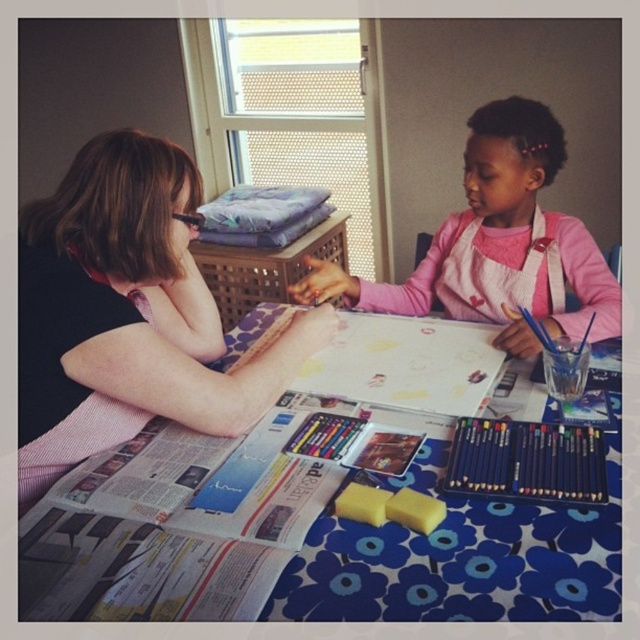
You are an artist who needs to store your supplies. You have a small box that can only hold items smaller than the pink fabric apron at upper right. Can the matte black pencils at lower right fit in the box?

The pink fabric apron at upper right is larger than the matte black pencils at lower right. Since the box can hold items smaller than the apron, the matte black pencils at lower right can fit in the box.

You are an observer looking at the table. Which object is positioned to the left of the other between the blue floral tablecloth at center and the pink fabric apron at upper right?

The blue floral tablecloth at center is to the left of the pink fabric apron at upper right.

You are a guest at this art table. You want to place a small vase between the blue floral tablecloth at center and the matte black pencils at lower right. Can you fit it there?

The blue floral tablecloth at center is taller than the matte black pencils at lower right, so there is enough space between them to place a small vase.